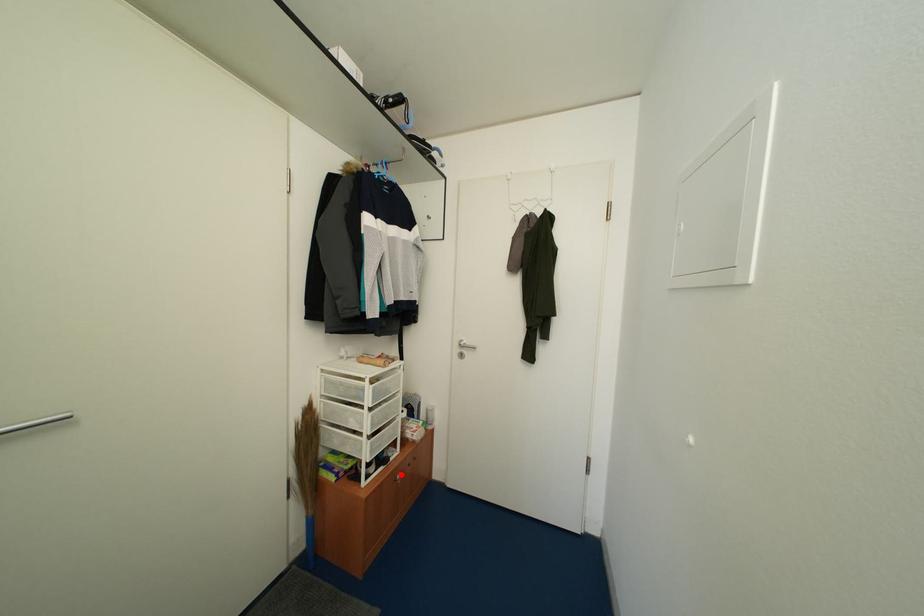
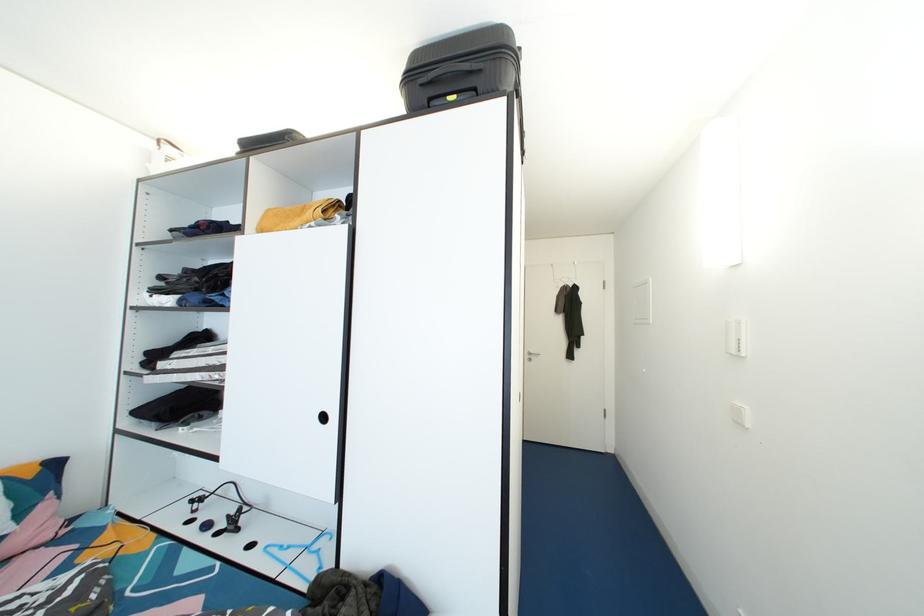
Question: I am providing you with two images of the same scene from different viewpoints. A red point is marked on the first image. At the location where the point appears in image 1, is it still visible in image 2?

Choices:
 (A) Yes
 (B) No

Answer: (B)